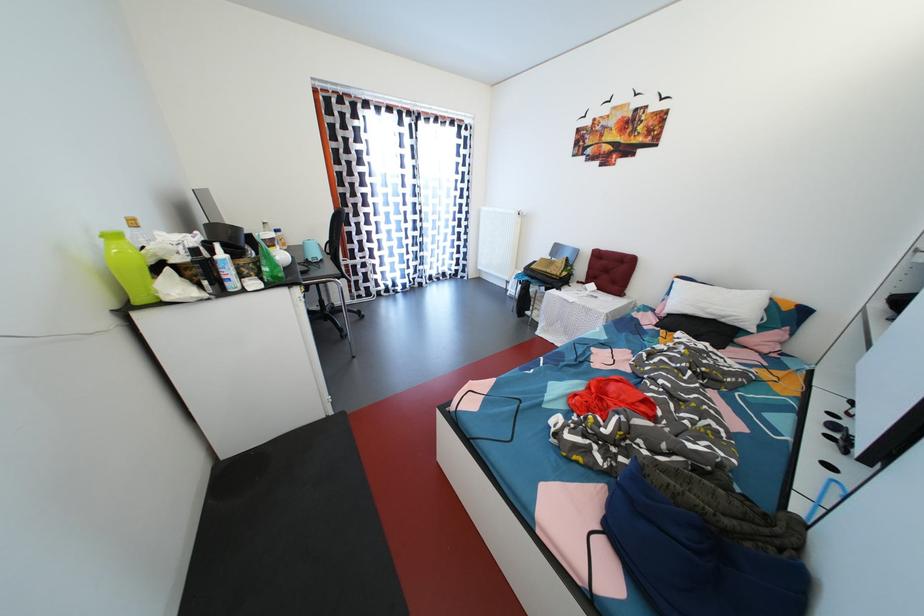
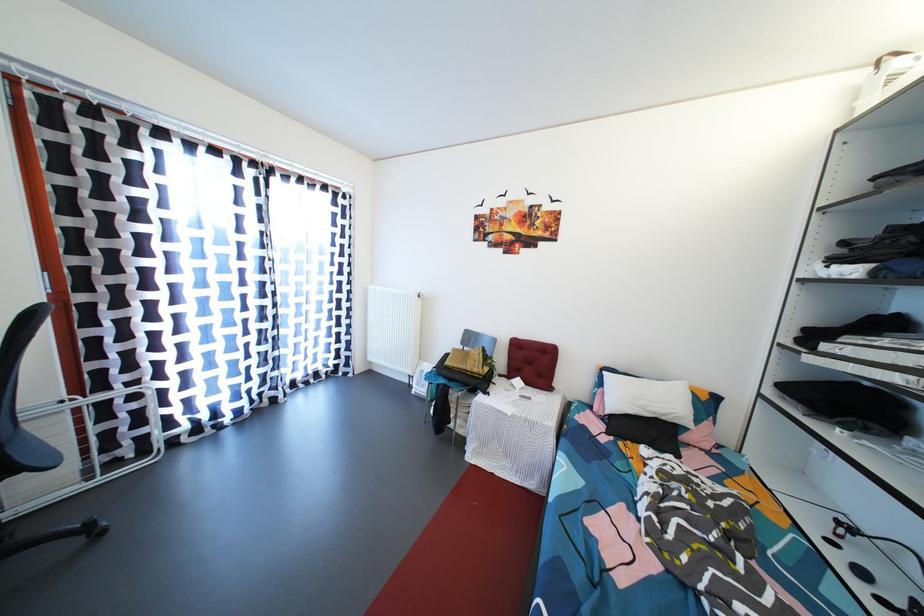
Question: The camera is either moving clockwise (left) or counter-clockwise (right) around the object. The first image is from the beginning of the video and the second image is from the end. Is the camera moving left or right when shooting the video?

Choices:
 (A) Left
 (B) Right

Answer: (A)